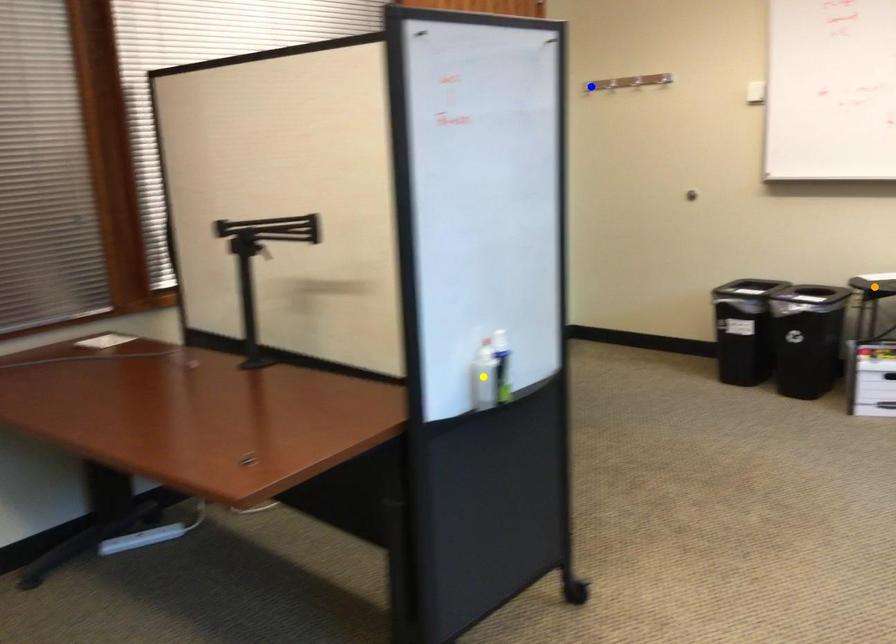
Order these from nearest to farthest:
1. yellow point
2. orange point
3. blue point

yellow point → orange point → blue point